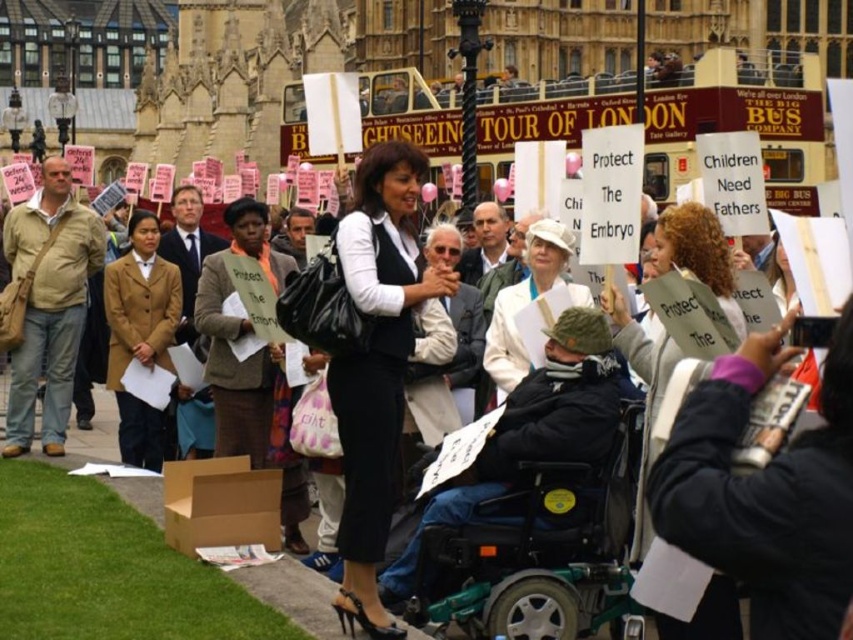
Question: Does teal plastic wheelchair at center appear on the right side of white fabric jacket at center?

Choices:
 (A) no
 (B) yes

Answer: (A)

Question: Which object is positioned closest to the matte black vest at center?

Choices:
 (A) matte brown coat at left
 (B) teal plastic wheelchair at center
 (C) white fabric hat at center
 (D) white fabric jacket at center

Answer: (B)

Question: Is teal plastic wheelchair at center in front of white fabric jacket at center?

Choices:
 (A) yes
 (B) no

Answer: (B)

Question: Which object is closer to the camera taking this photo?

Choices:
 (A) teal plastic wheelchair at center
 (B) matte black vest at center
 (C) white fabric hat at center
 (D) white fabric jacket at center

Answer: (D)

Question: Does white fabric jacket at center have a greater width compared to matte brown coat at left?

Choices:
 (A) no
 (B) yes

Answer: (B)

Question: Among these objects, which one is nearest to the camera?

Choices:
 (A) matte brown coat at left
 (B) white fabric hat at center

Answer: (B)